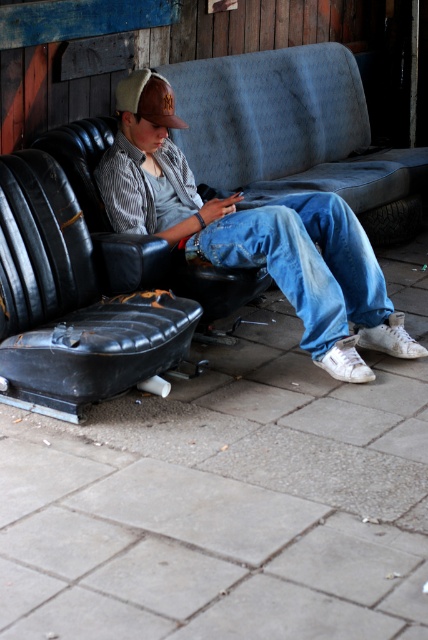
You are a delivery robot that is 1.5 meters tall. You need to deliver a package to the person sitting on the couch. The path to the couch is blocked by the gray concrete pavement at lower center and the brown leather baseball cap at upper center. Can you pass between them?

The gray concrete pavement at lower center and brown leather baseball cap at upper center are 2.01 meters apart from each other. Since the robot is 1.5 meters wide, it can pass between them as the distance is greater than the robot width.

You are standing in the scene and want to place a small plant pot between the black leather seat at left and the black rubber tire at lower right. Based on their positions, where should you place the pot so it is closer to the tire than the seat?

The black leather seat at left is below the black rubber tire at lower right, so placing the pot closer to the tire would mean positioning it above the seat but still between them.

You are standing in the rustic area described and want to place a small potted plant between the gray concrete pavement at lower center and the brown leather baseball cap at upper center. Based on their positions, where should the plant be placed?

The gray concrete pavement at lower center is in front of the brown leather baseball cap at upper center, so the plant should be placed between them, closer to the pavement since it is in front of the cap.